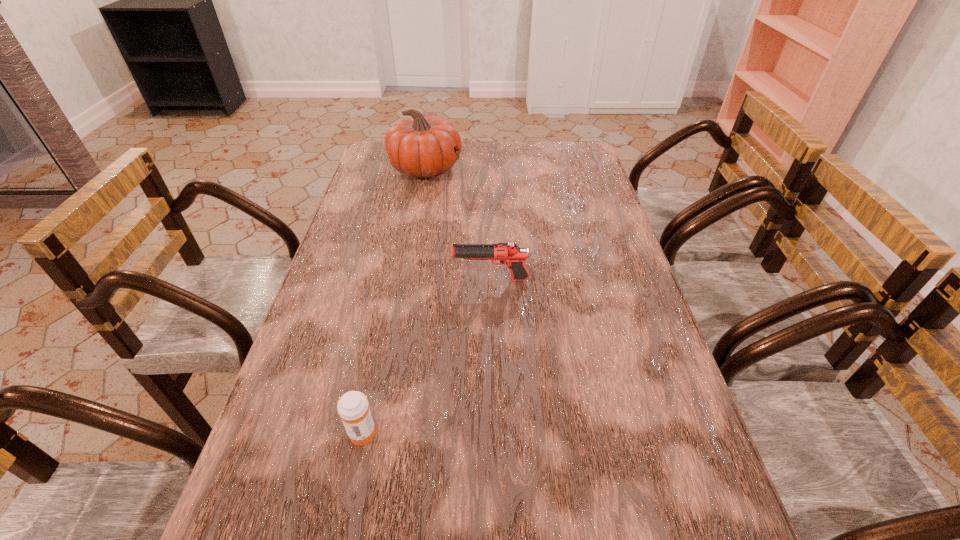
At what (x,y) coordinates should I click in order to perform the action: click on the farthest object. Please return your answer as a coordinate pair (x, y). Looking at the image, I should click on (420, 146).

Identify the location of the tallest object. The height and width of the screenshot is (540, 960). (420, 146).

Where is `gun`? This screenshot has width=960, height=540. gun is located at coordinates (508, 253).

Locate an element on the screen. the nearest object is located at coordinates (353, 408).

Where is `vacant space located on the face of the farthest object`? The image size is (960, 540). vacant space located on the face of the farthest object is located at coordinates (539, 168).

This screenshot has width=960, height=540. I want to click on free space located at the aiming end of the gun, so click(x=430, y=280).

The image size is (960, 540). Identify the location of free space located 0.240m at the aiming end of the gun. (361, 280).

The width and height of the screenshot is (960, 540). What are the coordinates of `free space located 0.180m at the aiming end of the gun` in the screenshot? It's located at (384, 280).

What are the coordinates of `vacant space located on the front of the nearest object` in the screenshot? It's located at (350, 485).

This screenshot has height=540, width=960. What are the coordinates of `object that is positioned at the far edge` in the screenshot? It's located at (420, 146).